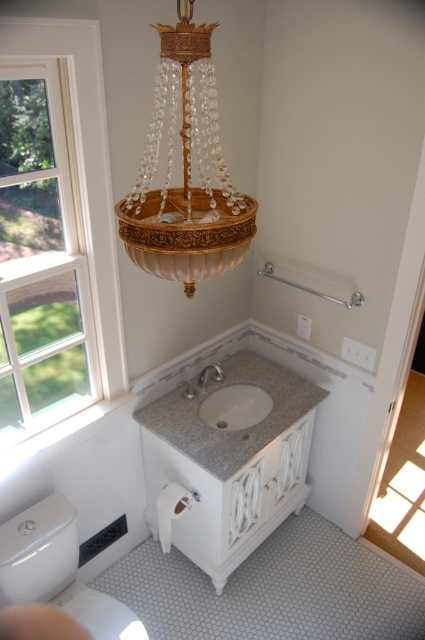
Question: Which object is farther from the camera taking this photo?

Choices:
 (A) gold crystal chandelier at upper center
 (B) satin nickel faucet at center

Answer: (B)

Question: Which object is the farthest from the clear glass window at upper left?

Choices:
 (A) satin nickel faucet at center
 (B) white granite sink at center
 (C) white glossy toilet bowl at lower left
 (D) gold crystal chandelier at upper center

Answer: (A)

Question: Can you confirm if clear glass window at upper left is positioned below white granite sink at center?

Choices:
 (A) no
 (B) yes

Answer: (A)

Question: Is gold crystal chandelier at upper center thinner than satin nickel faucet at center?

Choices:
 (A) yes
 (B) no

Answer: (B)

Question: Which object is the farthest from the gold crystal chandelier at upper center?

Choices:
 (A) white granite sink at center
 (B) white glossy toilet bowl at lower left

Answer: (B)

Question: Is gold crystal chandelier at upper center positioned before satin nickel faucet at center?

Choices:
 (A) yes
 (B) no

Answer: (A)